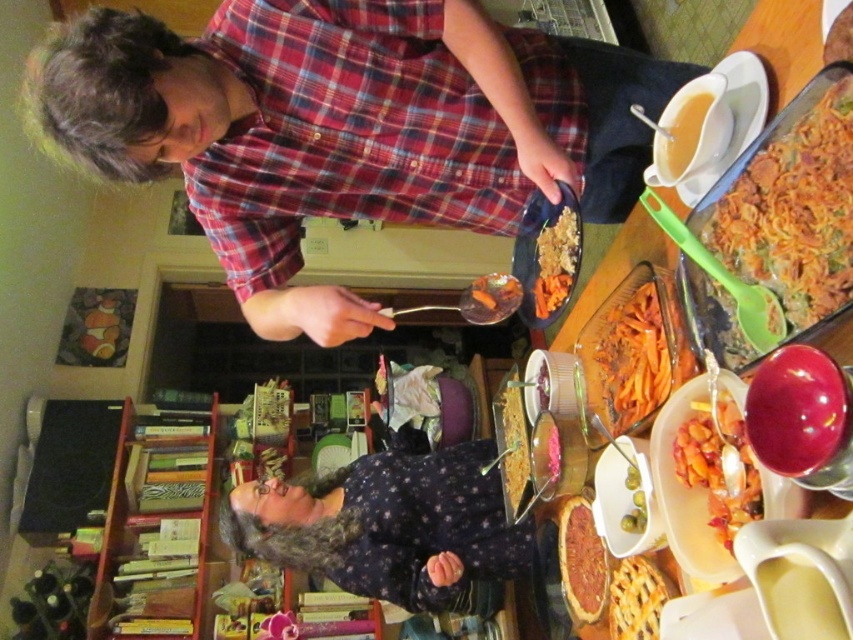
Does wooden bookshelf at lower left lie in front of smooth brown pie at center?

No, it is behind smooth brown pie at center.

How much distance is there between wooden bookshelf at lower left and smooth brown pie at center?

wooden bookshelf at lower left and smooth brown pie at center are 6.14 feet apart from each other.

Measure the distance between wooden bookshelf at lower left and camera.

wooden bookshelf at lower left is 2.59 meters away from camera.

At what (x,y) coordinates should I click in order to perform the action: click on wooden bookshelf at lower left. Please return your answer as a coordinate pair (x, y). This screenshot has height=640, width=853. Looking at the image, I should click on (155, 529).

Can you confirm if smooth brown pie at center is taller than shiny orange pasta at center?

No.

Is smooth brown pie at center smaller than shiny orange pasta at center?

Yes, smooth brown pie at center is smaller than shiny orange pasta at center.

Who is more forward, (590,609) or (496,412)?

Point (590,609)

The height and width of the screenshot is (640, 853). Identify the location of smooth brown pie at center. (581, 561).

Can you confirm if carrot orange pasta at right is smaller than yellow creamy gravy at upper right?

No, carrot orange pasta at right is not smaller than yellow creamy gravy at upper right.

Can you confirm if carrot orange pasta at right is shorter than yellow creamy gravy at upper right?

In fact, carrot orange pasta at right may be taller than yellow creamy gravy at upper right.

At what (x,y) coordinates should I click in order to perform the action: click on carrot orange pasta at right. Please return your answer as a coordinate pair (x, y). This screenshot has height=640, width=853. Looking at the image, I should click on (791, 204).

Identify the location of carrot orange pasta at right. (791, 204).